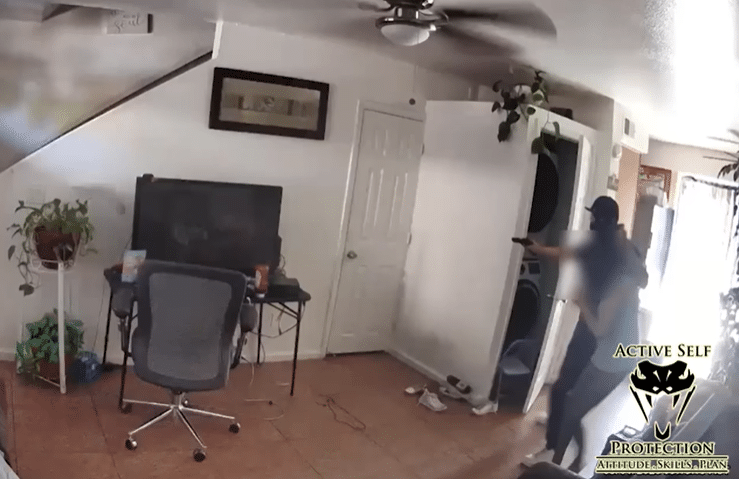
Image resolution: width=739 pixels, height=479 pixels. I want to click on fridge, so [x=652, y=229].